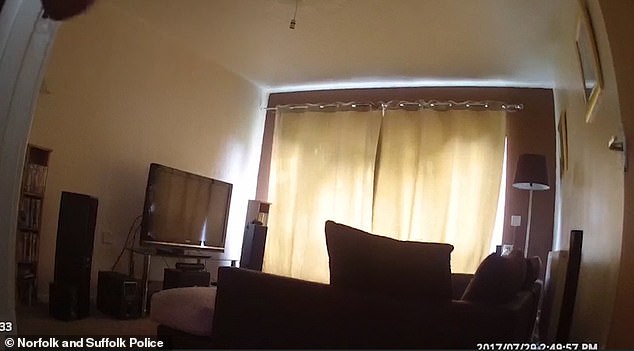
At what (x,y) coordinates should I click in order to perform the action: click on metallic door handle. Please return your answer as a coordinate pair (x, y). The height and width of the screenshot is (351, 634). Looking at the image, I should click on (612, 146).